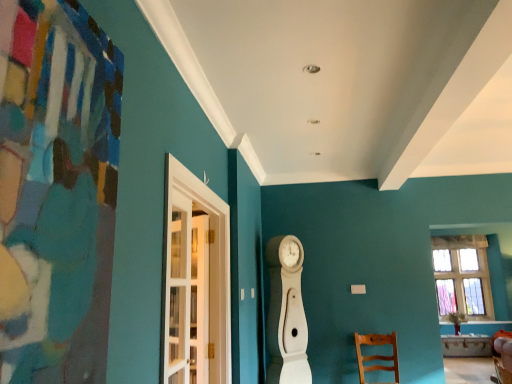
Question: Could white glass door at left be considered to be inside clear glass window at right?

Choices:
 (A) no
 (B) yes

Answer: (A)

Question: Considering the relative sizes of clear glass window at right and white glass door at left in the image provided, is clear glass window at right smaller than white glass door at left?

Choices:
 (A) no
 (B) yes

Answer: (B)

Question: Is there a large distance between clear glass window at right and white glass door at left?

Choices:
 (A) no
 (B) yes

Answer: (B)

Question: Is clear glass window at right at the right side of white glass door at left?

Choices:
 (A) no
 (B) yes

Answer: (B)

Question: Is clear glass window at right taller than white glass door at left?

Choices:
 (A) yes
 (B) no

Answer: (A)

Question: Does clear glass window at right turn towards white glass door at left?

Choices:
 (A) no
 (B) yes

Answer: (A)

Question: From the image's perspective, does white glass door at left appear lower than clear glass window at right?

Choices:
 (A) yes
 (B) no

Answer: (B)

Question: Is white glass door at left positioned in front of clear glass window at right?

Choices:
 (A) no
 (B) yes

Answer: (B)

Question: Can you confirm if white glass door at left is taller than clear glass window at right?

Choices:
 (A) yes
 (B) no

Answer: (B)

Question: From a real-world perspective, is white glass door at left over clear glass window at right?

Choices:
 (A) no
 (B) yes

Answer: (B)

Question: Could clear glass window at right be considered to be inside white glass door at left?

Choices:
 (A) no
 (B) yes

Answer: (A)

Question: From a real-world perspective, is white glass door at left under clear glass window at right?

Choices:
 (A) yes
 (B) no

Answer: (B)

Question: Is the position of wooden chair at lower right less distant than that of white glass door at left?

Choices:
 (A) no
 (B) yes

Answer: (A)